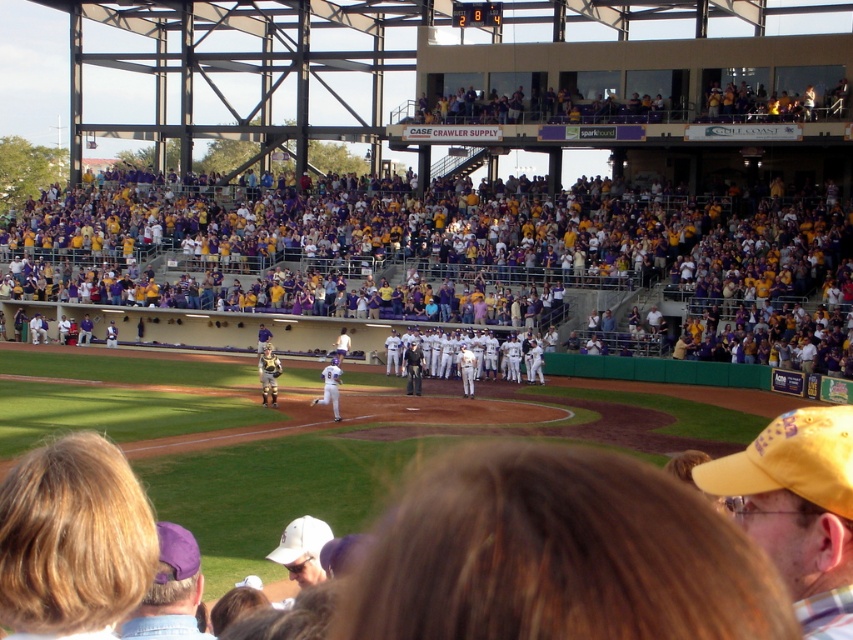
Is the position of yellow fabric cap at upper right less distant than that of gold metallic helmet at center?

Yes, yellow fabric cap at upper right is closer to the viewer.

You are a GUI agent. You are given a task and a screenshot of the screen. Output one action in this format:
    pyautogui.click(x=<x>, y=<y>)
    Task: Click on the yellow fabric cap at upper right
    
    Given the screenshot: What is the action you would take?
    pyautogui.click(x=799, y=508)

What do you see at coordinates (799, 508) in the screenshot? I see `yellow fabric cap at upper right` at bounding box center [799, 508].

Image resolution: width=853 pixels, height=640 pixels. I want to click on yellow fabric cap at upper right, so click(x=799, y=508).

Does purple fabric cap at lower left have a lesser height compared to white matte baseball cap at lower center?

No, purple fabric cap at lower left is not shorter than white matte baseball cap at lower center.

This screenshot has height=640, width=853. Identify the location of purple fabric cap at lower left. pyautogui.click(x=170, y=592).

At what (x,y) coordinates should I click in order to perform the action: click on purple fabric cap at lower left. Please return your answer as a coordinate pair (x, y). The width and height of the screenshot is (853, 640). Looking at the image, I should click on (170, 592).

Between purple/yellow jersey at upper center and white uniformed players at center, which one is positioned higher?

Positioned higher is purple/yellow jersey at upper center.

Is purple/yellow jersey at upper center wider than white uniformed players at center?

Yes, purple/yellow jersey at upper center is wider than white uniformed players at center.

Is point (206, 228) positioned before point (427, 372)?

No, (206, 228) is behind (427, 372).

Find the location of a particular element. The width and height of the screenshot is (853, 640). purple/yellow jersey at upper center is located at coordinates (460, 259).